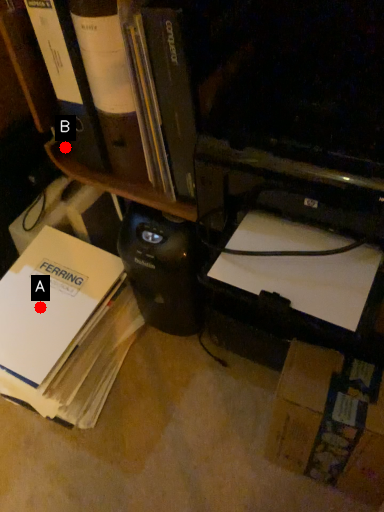
Question: Two points are circled on the image, labeled by A and B beside each circle. Which of the following is the farthest from the observer?

Choices:
 (A) A is further
 (B) B is further

Answer: (A)